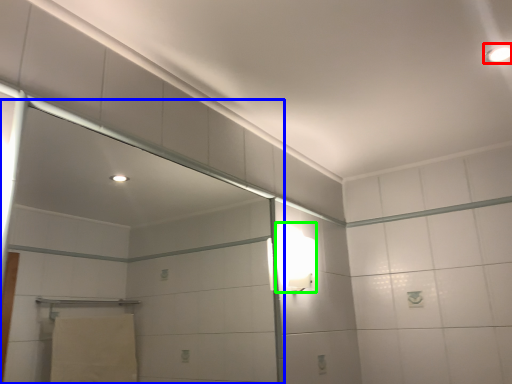
Question: Which is nearer to the light fixture (highlighted by a red box)? screen door (highlighted by a blue box) or light fixture (highlighted by a green box).

Choices:
 (A) screen door
 (B) light fixture

Answer: (B)